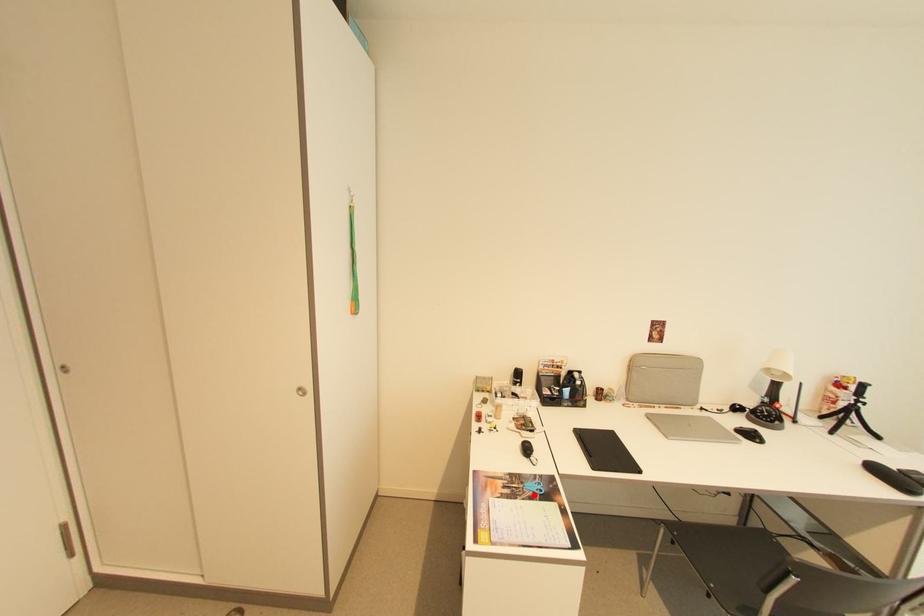
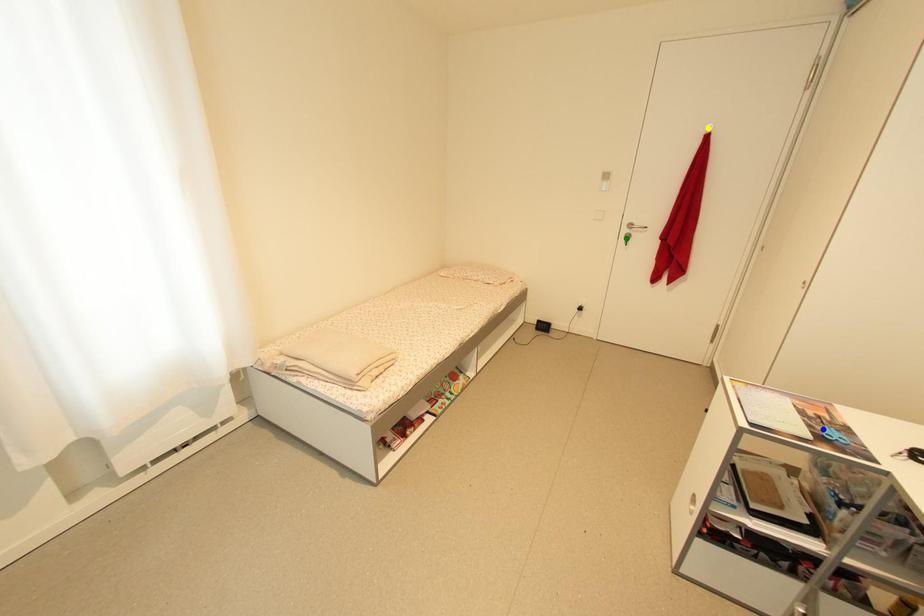
Question: I am providing you with two images of the same scene from different viewpoints. A red point is marked on the first image. You are given multiple points on the second image. Which point in image 2 is actually the same real-world point as the red point in image 1?

Choices:
 (A) blue point
 (B) yellow point
 (C) green point

Answer: (A)